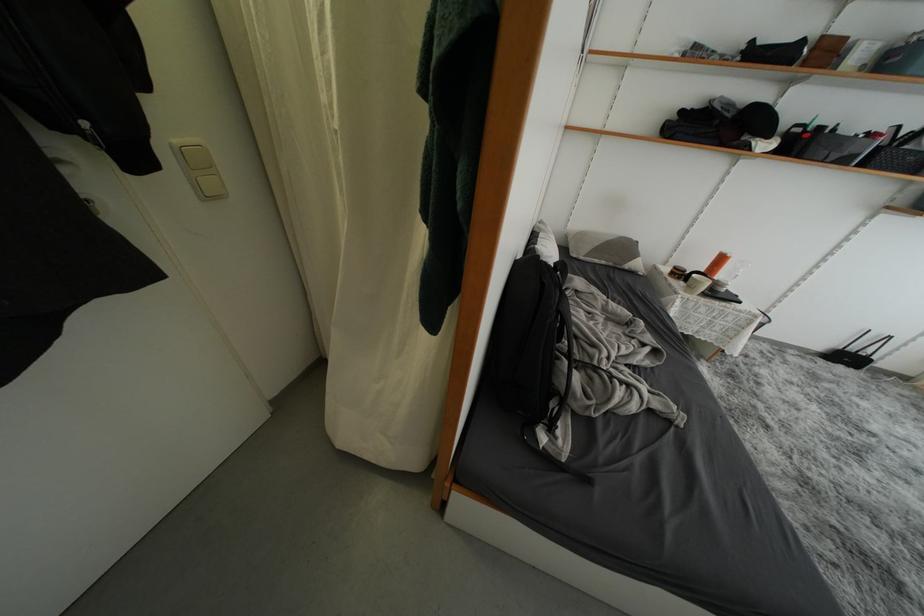
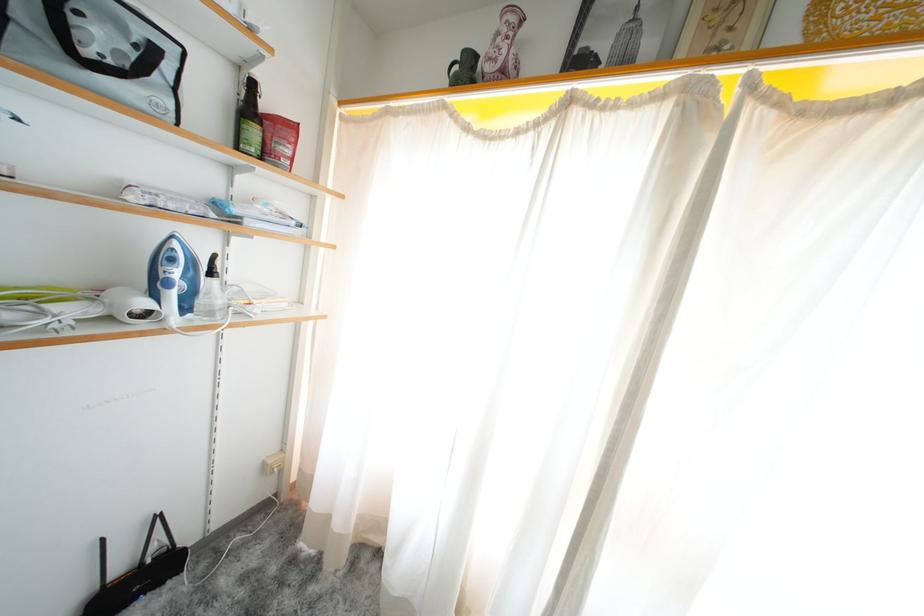
The point at (854,362) is marked in the first image. Where is the corresponding point in the second image?

(143, 586)